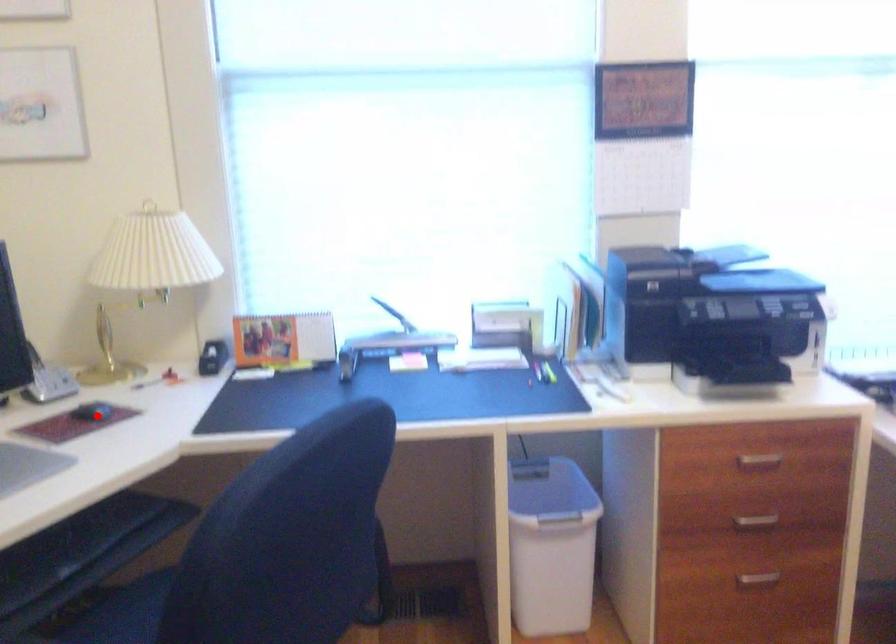
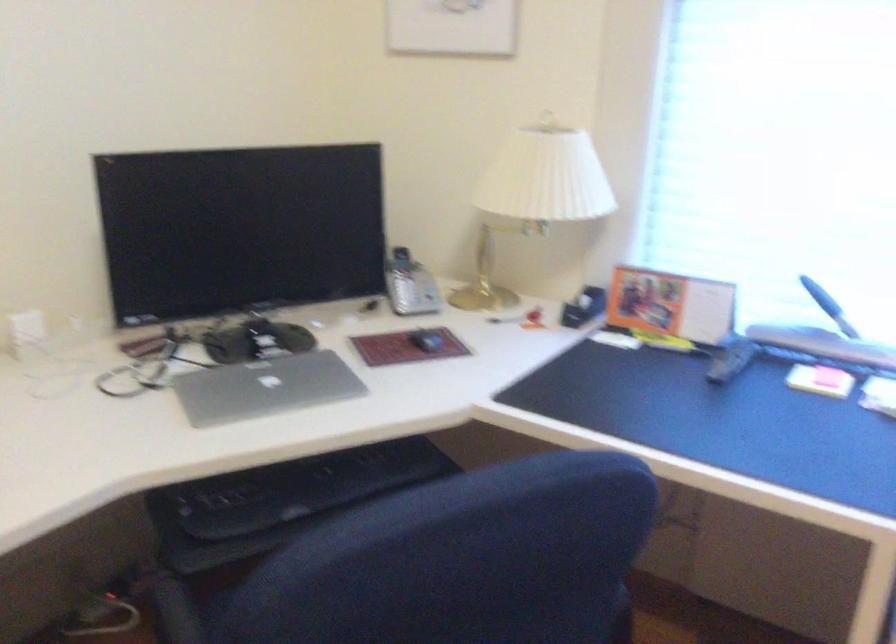
Locate, in the second image, the point that corresponds to the highlighted location in the first image.

(426, 341)